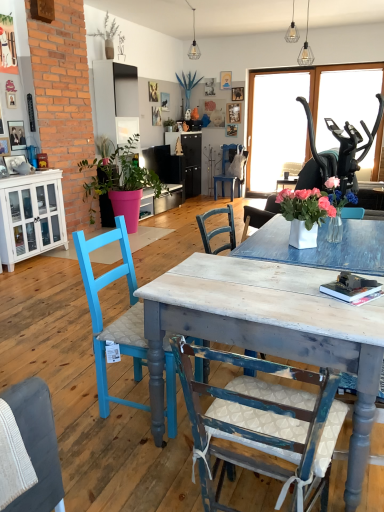
Question: Does white glass cabinet at left have a lesser height compared to distressed wood table at center?

Choices:
 (A) yes
 (B) no

Answer: (B)

Question: Does white glass cabinet at left turn towards distressed wood table at center?

Choices:
 (A) yes
 (B) no

Answer: (B)

Question: Can you confirm if white glass cabinet at left is taller than distressed wood table at center?

Choices:
 (A) no
 (B) yes

Answer: (B)

Question: From the image's perspective, is white glass cabinet at left located beneath distressed wood table at center?

Choices:
 (A) yes
 (B) no

Answer: (B)

Question: From the image's perspective, is white glass cabinet at left on top of distressed wood table at center?

Choices:
 (A) no
 (B) yes

Answer: (B)

Question: Does white glass cabinet at left appear on the left side of distressed wood table at center?

Choices:
 (A) no
 (B) yes

Answer: (B)

Question: Can you confirm if woven fabric chair at lower left, which is counted as the second chair, starting from the front, is taller than matte pink pot at left, which ranks as the third houseplant in back-to-front order?

Choices:
 (A) no
 (B) yes

Answer: (A)

Question: Is woven fabric chair at lower left, marked as the 3th chair in a back-to-front arrangement, placed right next to matte pink pot at left, the 3th houseplant in the top-to-bottom sequence?

Choices:
 (A) yes
 (B) no

Answer: (B)

Question: Does woven fabric chair at lower left, marked as the 3th chair in a back-to-front arrangement, appear on the left side of matte pink pot at left, the 3th houseplant in the top-to-bottom sequence?

Choices:
 (A) no
 (B) yes

Answer: (A)

Question: Is woven fabric chair at lower left, marked as the 3th chair in a back-to-front arrangement, not near matte pink pot at left, which ranks as the third houseplant in back-to-front order?

Choices:
 (A) yes
 (B) no

Answer: (A)

Question: From a real-world perspective, is woven fabric chair at lower left, placed as the 3th chair when sorted from top to bottom, located beneath matte pink pot at left, marked as the first houseplant in a front-to-back arrangement?

Choices:
 (A) no
 (B) yes

Answer: (B)

Question: Considering the relative sizes of woven fabric chair at lower left, the 2th chair ordered from the bottom, and matte pink pot at left, the 3th houseplant in the top-to-bottom sequence, in the image provided, is woven fabric chair at lower left, the 2th chair ordered from the bottom, shorter than matte pink pot at left, the 3th houseplant in the top-to-bottom sequence,?

Choices:
 (A) no
 (B) yes

Answer: (B)

Question: Can you confirm if matte pink pot at left, the 1th houseplant in the bottom-to-top sequence, is taller than clear glass pendant light at upper center, the 3th lamp from the front?

Choices:
 (A) no
 (B) yes

Answer: (B)